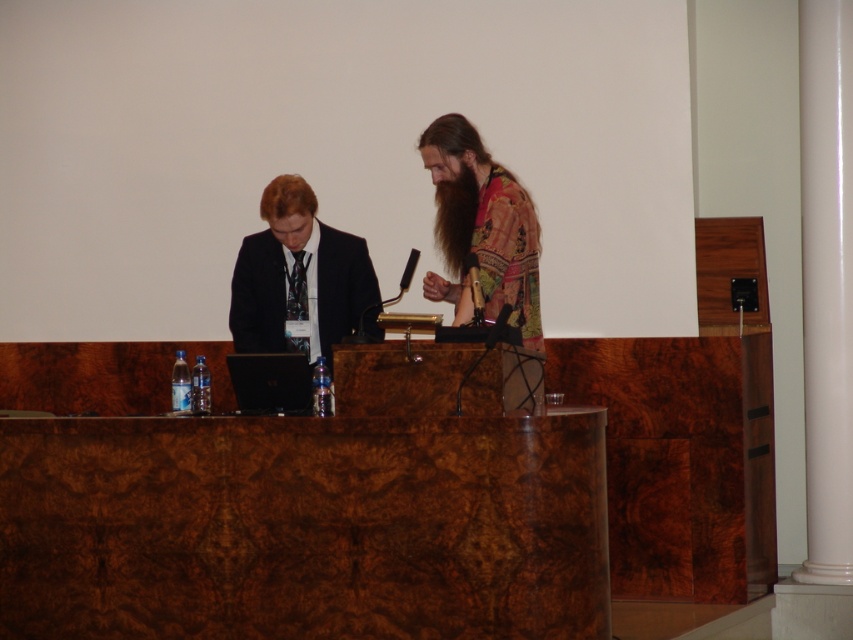
Question: Can you confirm if brown wood table at center is positioned above matte black suit at center?

Choices:
 (A) yes
 (B) no

Answer: (B)

Question: Which point is farther from the camera taking this photo?

Choices:
 (A) (318, 227)
 (B) (409, 480)

Answer: (A)

Question: Does brown wood table at center appear over matte black suit at center?

Choices:
 (A) no
 (B) yes

Answer: (A)

Question: Is brown wood table at center behind matte black suit at center?

Choices:
 (A) yes
 (B) no

Answer: (B)

Question: Which point is farther to the camera?

Choices:
 (A) matte black suit at center
 (B) brown wood table at center

Answer: (A)